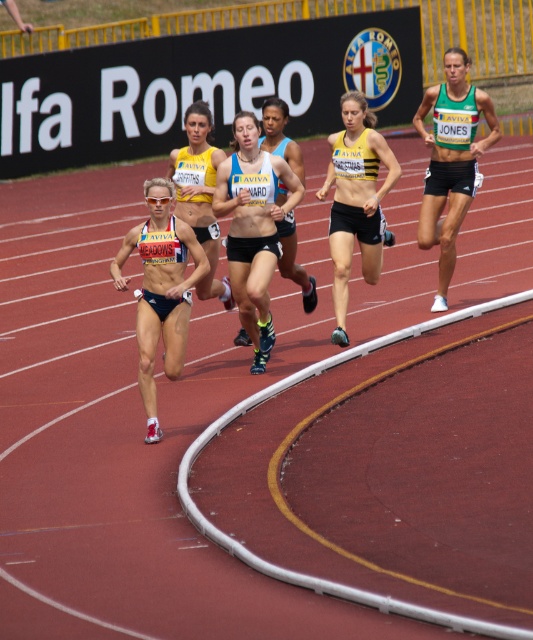
You are a photographer at the track event and want to capture the athlete wearing the matte blue shorts at center. According to the coordinates provided, where should you aim your camera to ensure the shorts are in the frame?

You should aim your camera at point (254, 227) to capture the matte blue shorts at center.

You are a photographer positioned at the finish line of the race. You want to capture a closeup of the athlete wearing the matte blue shorts at center and the matte blue tank top at center. Which piece of clothing will appear larger in your photo?

The matte blue shorts at center will appear larger in the photo because it is closer to the viewer than the matte blue tank top at center.